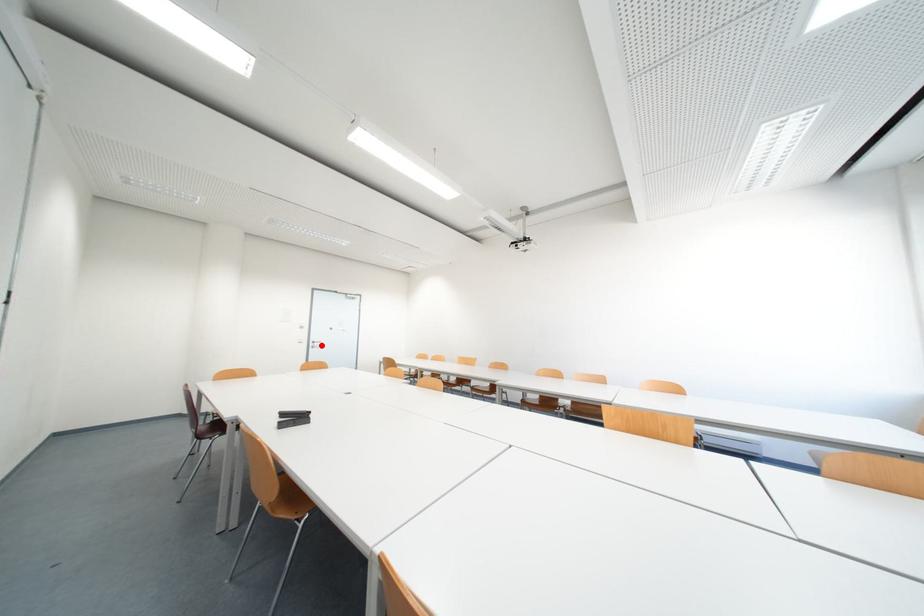
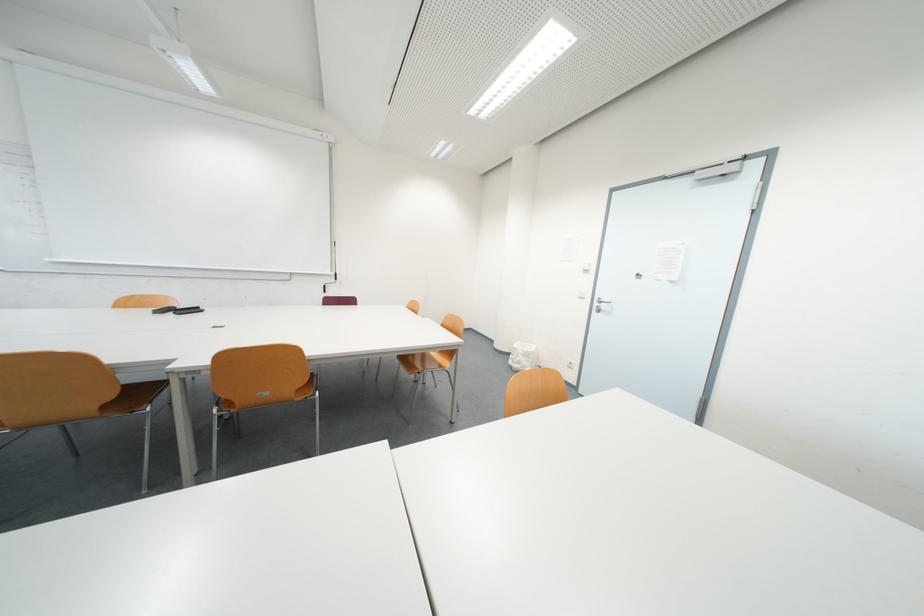
Find the pixel in the second image that matches the highlighted location in the first image.

(605, 305)